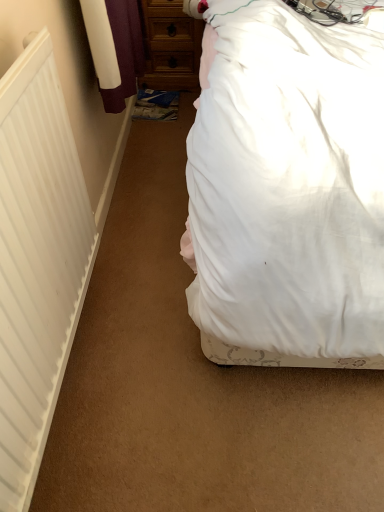
Identify the location of vacant region below white matte radiator at left (from a real-world perspective). (71, 385).